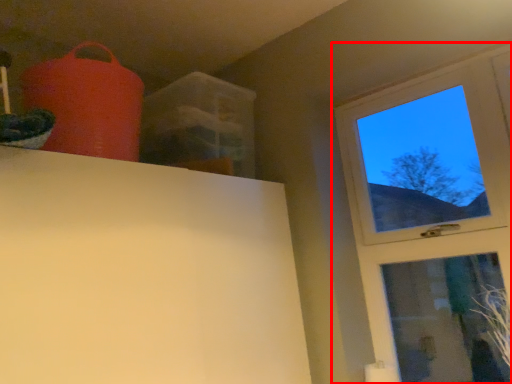
Question: Considering the relative positions of window (annotated by the red box) and plant in the image provided, where is window (annotated by the red box) located with respect to the staircase?

Choices:
 (A) right
 (B) left

Answer: (B)